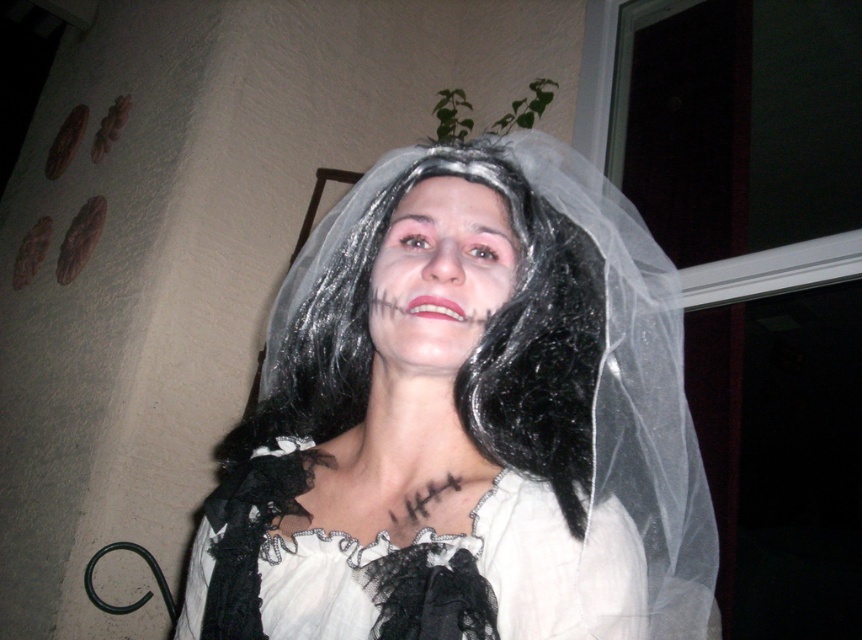
Question: Does white lace veil at center have a greater width compared to white lace dress at center?

Choices:
 (A) no
 (B) yes

Answer: (B)

Question: Is white lace veil at center below white lace dress at center?

Choices:
 (A) yes
 (B) no

Answer: (B)

Question: Is white lace veil at center to the right of white lace dress at center from the viewer's perspective?

Choices:
 (A) no
 (B) yes

Answer: (B)

Question: Which point is farther to the camera?

Choices:
 (A) (376, 598)
 (B) (226, 531)

Answer: (B)